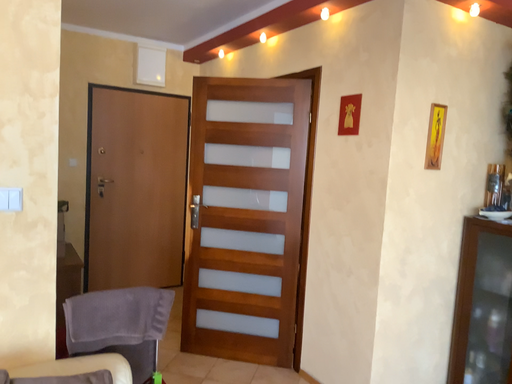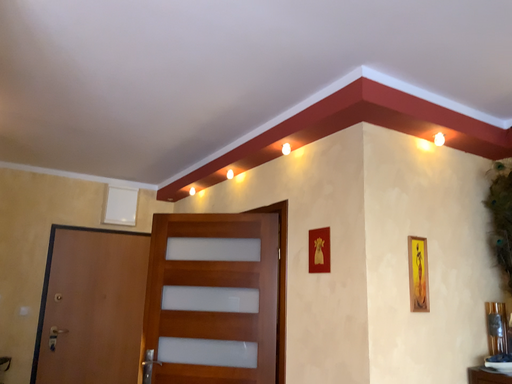
Question: Which way did the camera rotate in the video?

Choices:
 (A) rotated upward
 (B) rotated downward

Answer: (A)